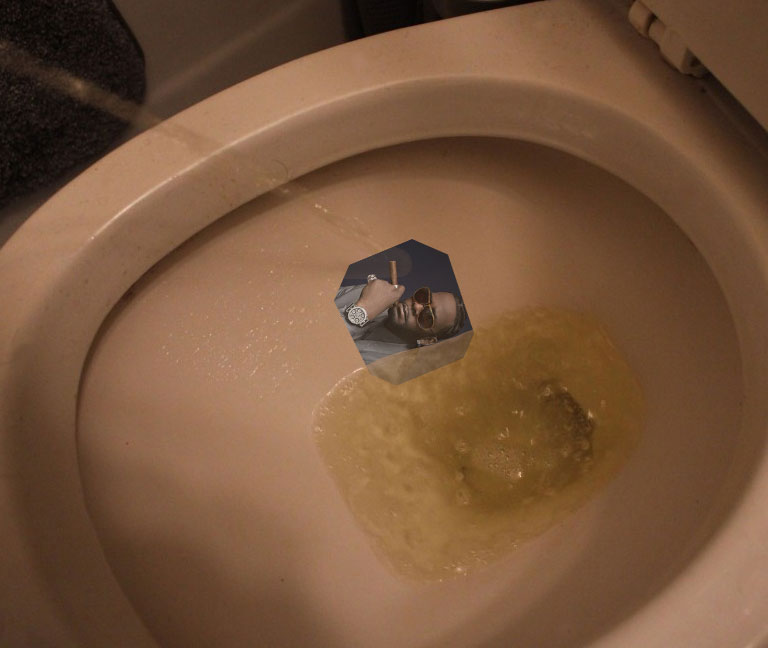
Find the location of a particular element. This screenshot has width=768, height=648. wall is located at coordinates (177, 45).